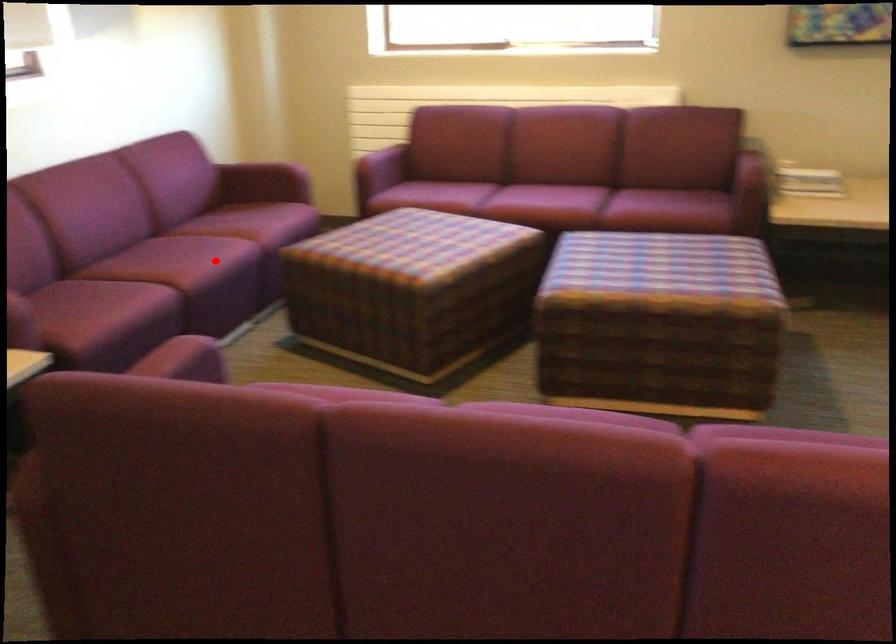
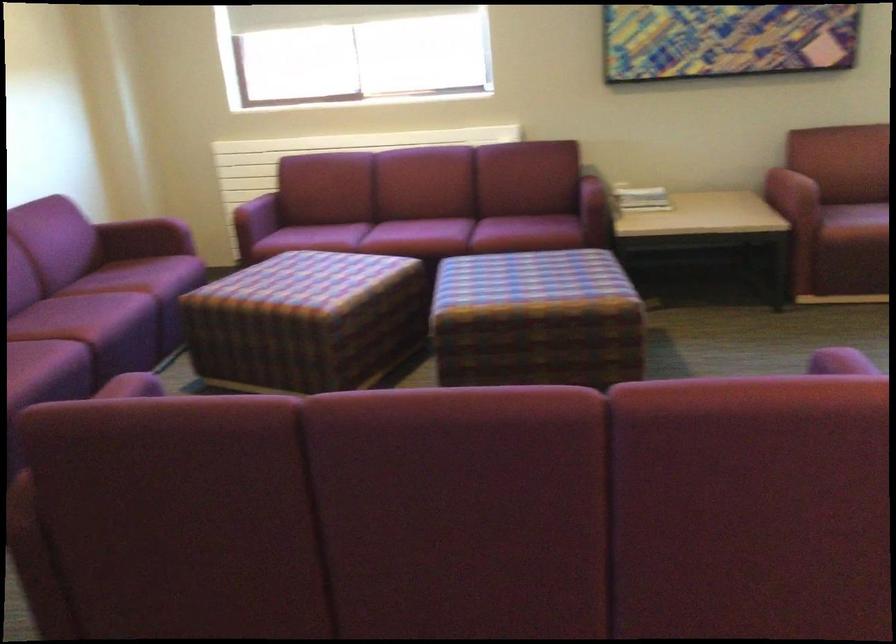
The point at the highlighted location is marked in the first image. Where is the corresponding point in the second image?

(116, 313)